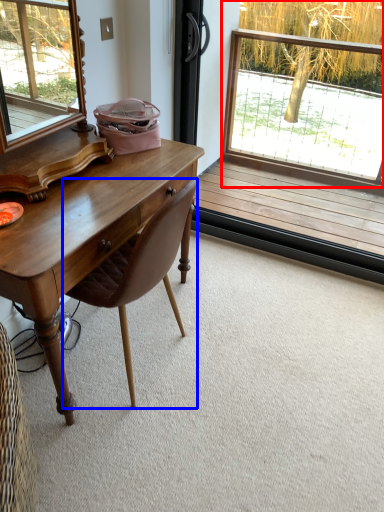
Question: Which object is closer to the camera taking this photo, window (highlighted by a red box) or chair (highlighted by a blue box)?

Choices:
 (A) window
 (B) chair

Answer: (B)